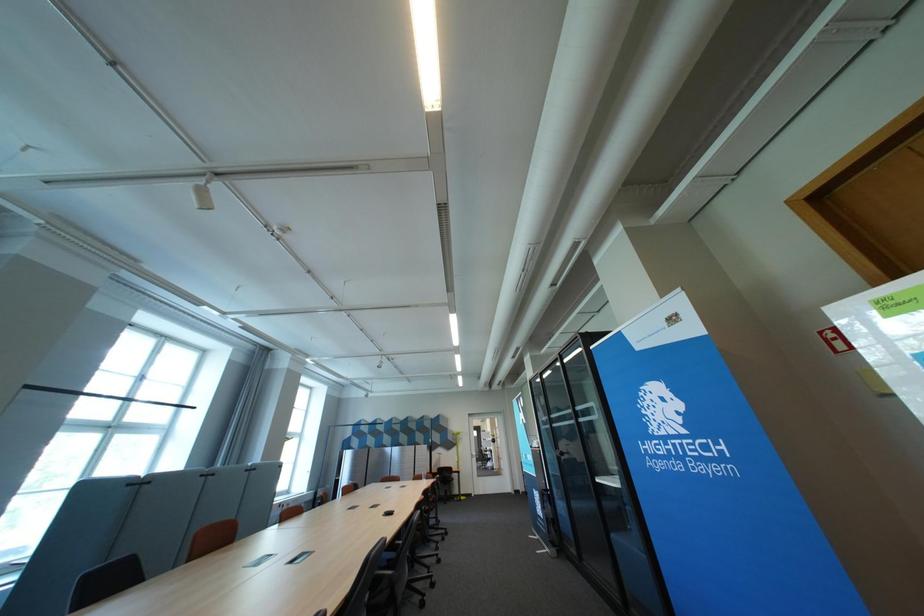
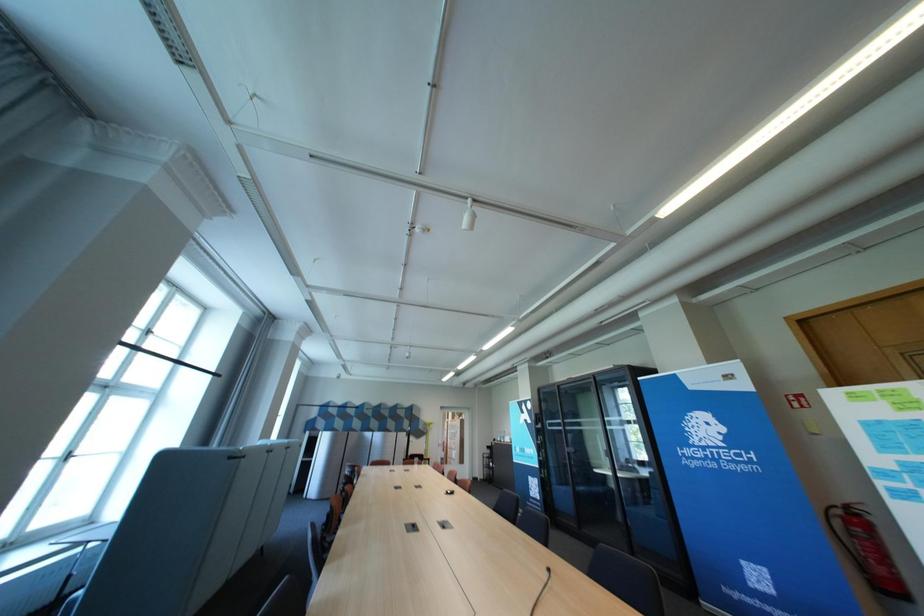
Question: The images are taken continuously from a first-person perspective. In which direction are you moving?

Choices:
 (A) Left
 (B) Right
 (C) Forward
 (D) Backward

Answer: (A)